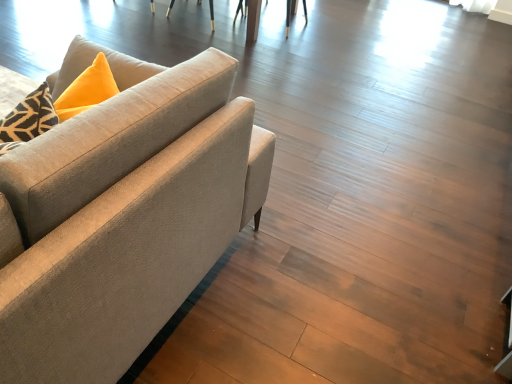
Find the location of a particular element. The image size is (512, 384). vacant area that is situated to the right of textured beige couch at left is located at coordinates (337, 278).